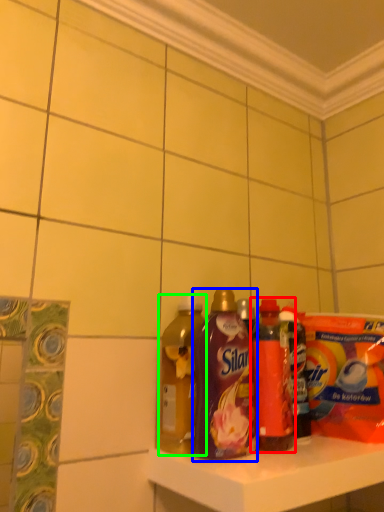
Question: Which object is the farthest from bottle (highlighted by a red box)? Choose among these: bottle (highlighted by a blue box) or bottle (highlighted by a green box).

Choices:
 (A) bottle
 (B) bottle

Answer: (B)